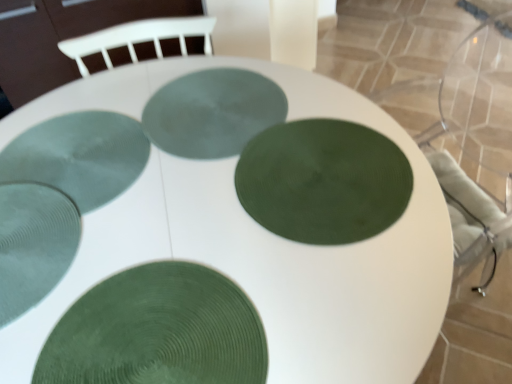
Locate an element on the screen. The image size is (512, 384). empty space that is in between green textured glass plate at center, positioned as the 3th glass plate in back-to-front order, and clear textured glass at bottom left, positioned as the 2th glass plate in front-to-back order is located at coordinates (163, 218).